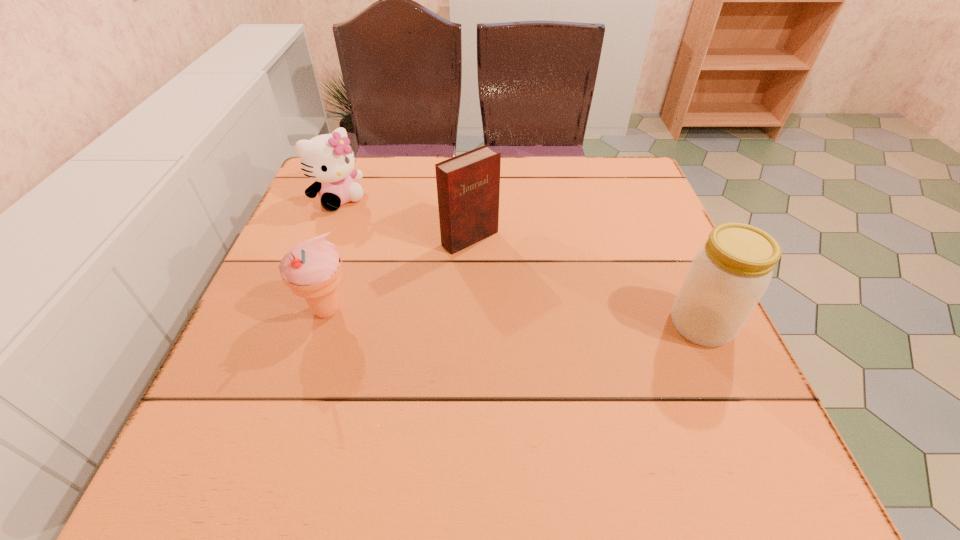
This screenshot has width=960, height=540. I want to click on free space at the right edge of the desktop, so click(x=671, y=336).

Where is `free space at the far left corner`? free space at the far left corner is located at coordinates (354, 170).

This screenshot has width=960, height=540. I want to click on vacant space at the far right corner, so click(589, 194).

You are a GUI agent. You are given a task and a screenshot of the screen. Output one action in this format:
    pyautogui.click(x=<x>, y=<y>)
    Task: Click on the vacant point at the near right corner
    
    Given the screenshot: What is the action you would take?
    pyautogui.click(x=761, y=417)

At what (x,y) coordinates should I click in order to perform the action: click on free spot between the farthest object and the jar. Please return your answer as a coordinate pair (x, y). Looking at the image, I should click on (520, 262).

The height and width of the screenshot is (540, 960). I want to click on free point between the rightmost object and the farthest object, so click(520, 262).

Where is `unoccupied area between the diary and the icecream`? Image resolution: width=960 pixels, height=540 pixels. unoccupied area between the diary and the icecream is located at coordinates pyautogui.click(x=398, y=274).

The image size is (960, 540). Find the location of `empty location between the farthest object and the second farthest object`. empty location between the farthest object and the second farthest object is located at coordinates (404, 219).

Locate an element on the screen. The height and width of the screenshot is (540, 960). empty space that is in between the icecream and the jar is located at coordinates (514, 318).

Find the location of a particular element. The height and width of the screenshot is (540, 960). free space that is in between the third nearest object and the rightmost object is located at coordinates (586, 281).